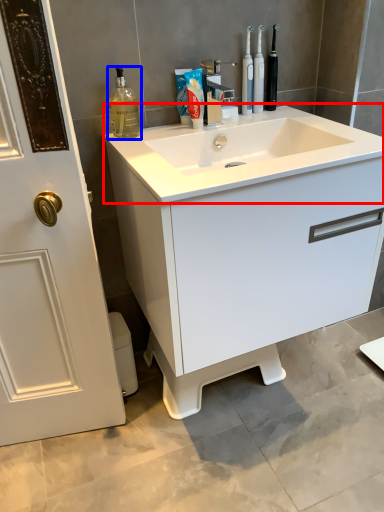
Question: Among these objects, which one is farthest to the camera, counter top (highlighted by a red box) or cleaning product (highlighted by a blue box)?

Choices:
 (A) counter top
 (B) cleaning product

Answer: (B)